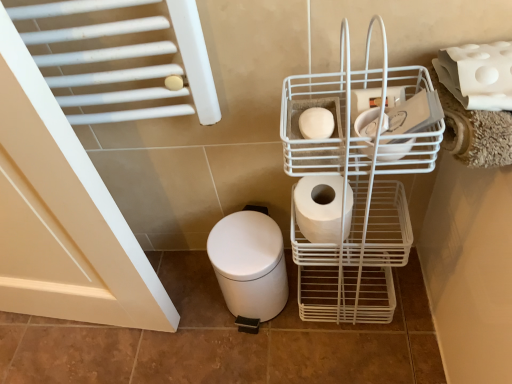
Identify the location of vacant space in front of white wire basket at center right. (362, 357).